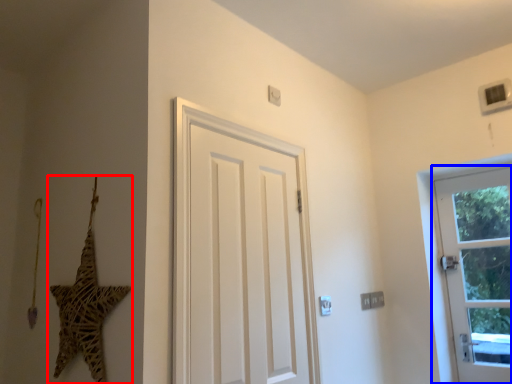
Question: Which object is closer to the camera taking this photo, star (highlighted by a red box) or door (highlighted by a blue box)?

Choices:
 (A) star
 (B) door

Answer: (A)